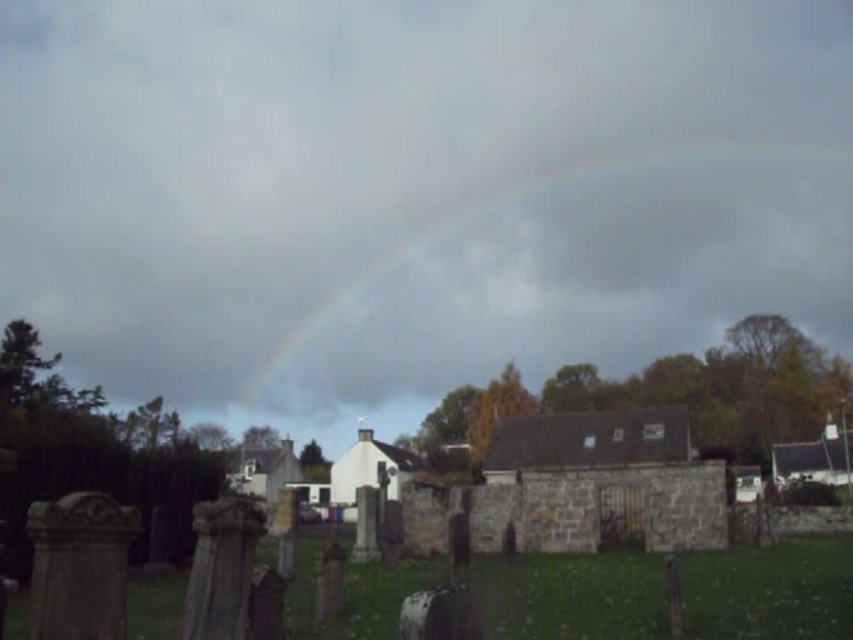
Question: Which point is closer to the camera taking this photo?

Choices:
 (A) (372, 378)
 (B) (102, 499)

Answer: (B)

Question: Can you confirm if rainbow at upper center is positioned to the right of smooth stone gravestone at lower left?

Choices:
 (A) no
 (B) yes

Answer: (B)

Question: Among these points, which one is farthest from the camera?

Choices:
 (A) (664, 170)
 (B) (93, 570)

Answer: (A)

Question: Is rainbow at upper center positioned at the back of smooth stone gravestone at lower left?

Choices:
 (A) no
 (B) yes

Answer: (B)

Question: Does rainbow at upper center appear under smooth stone gravestone at lower left?

Choices:
 (A) no
 (B) yes

Answer: (A)